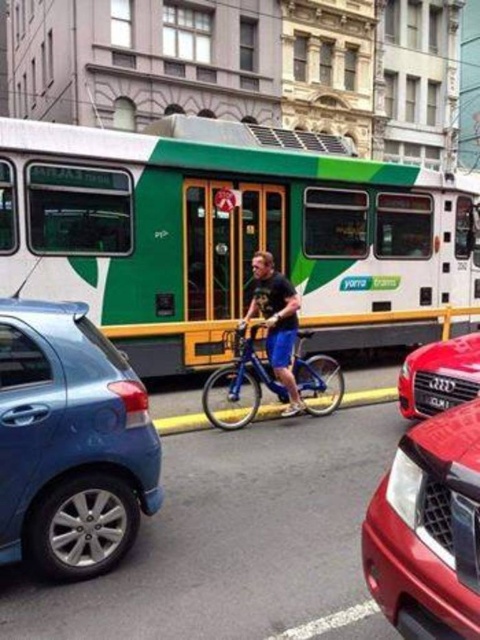
Question: Can you confirm if green matte bus at center is thinner than blue metallic bicycle at center?

Choices:
 (A) no
 (B) yes

Answer: (A)

Question: Based on their relative distances, which object is farther from the matte black shirt at center?

Choices:
 (A) green matte bus at center
 (B) shiny red audi at center

Answer: (A)

Question: Which of the following is the closest to the observer?

Choices:
 (A) satin blue sedan at lower left
 (B) matte black shirt at center
 (C) shiny red audi at center

Answer: (A)

Question: Can you confirm if blue metallic bicycle at center is wider than matte black shirt at center?

Choices:
 (A) no
 (B) yes

Answer: (B)

Question: Is blue metallic bicycle at center bigger than matte black shirt at center?

Choices:
 (A) no
 (B) yes

Answer: (B)

Question: Which object is farther from the camera taking this photo?

Choices:
 (A) green matte bus at center
 (B) blue metallic bicycle at center

Answer: (A)